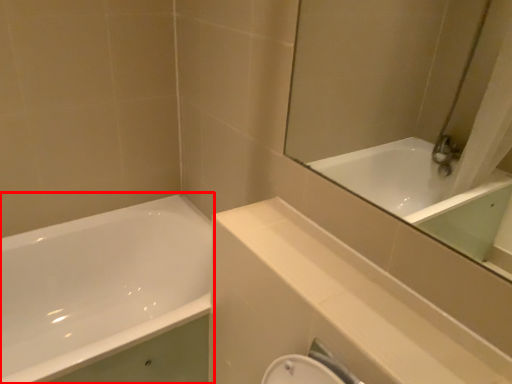
Question: Where is bathtub (annotated by the red box) located in relation to balustrade in the image?

Choices:
 (A) left
 (B) right

Answer: (A)